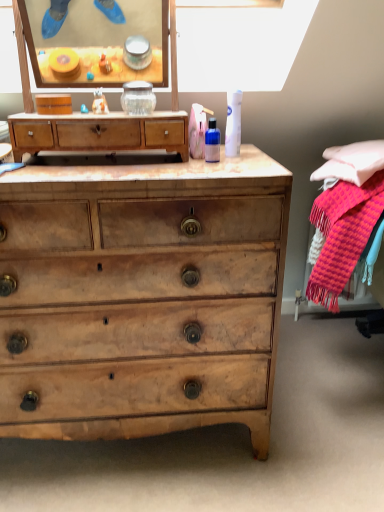
Question: Is translucent plastic bottle at center, which is counted as the second toiletry, starting from the right, a part of light brown wooden chest of drawers at center, which ranks as the first chest of drawers in top-to-bottom order?

Choices:
 (A) yes
 (B) no

Answer: (B)

Question: From the image's perspective, does light brown wooden chest of drawers at center, which ranks as the first chest of drawers in top-to-bottom order, appear lower than translucent plastic bottle at center, which is counted as the second toiletry, starting from the right?

Choices:
 (A) no
 (B) yes

Answer: (A)

Question: Considering the relative sizes of light brown wooden chest of drawers at center, the second chest of drawers in the bottom-to-top sequence, and translucent plastic bottle at center, positioned as the first toiletry in left-to-right order, in the image provided, is light brown wooden chest of drawers at center, the second chest of drawers in the bottom-to-top sequence, smaller than translucent plastic bottle at center, positioned as the first toiletry in left-to-right order,?

Choices:
 (A) no
 (B) yes

Answer: (A)

Question: Does light brown wooden chest of drawers at center, the second chest of drawers in the bottom-to-top sequence, turn towards translucent plastic bottle at center, which is counted as the second toiletry, starting from the right?

Choices:
 (A) yes
 (B) no

Answer: (B)

Question: Can we say light brown wooden chest of drawers at center, the second chest of drawers in the bottom-to-top sequence, lies outside translucent plastic bottle at center, which is counted as the second toiletry, starting from the right?

Choices:
 (A) no
 (B) yes

Answer: (B)

Question: Considering the relative positions of light brown wooden chest of drawers at center, which ranks as the first chest of drawers in top-to-bottom order, and translucent plastic bottle at center, which is counted as the second toiletry, starting from the right, in the image provided, is light brown wooden chest of drawers at center, which ranks as the first chest of drawers in top-to-bottom order, to the right of translucent plastic bottle at center, which is counted as the second toiletry, starting from the right, from the viewer's perspective?

Choices:
 (A) yes
 (B) no

Answer: (B)

Question: Is translucent plastic bottle at center, which is counted as the second toiletry, starting from the right, touching white matte canister at upper center, acting as the first toiletry starting from the right?

Choices:
 (A) no
 (B) yes

Answer: (B)

Question: Is translucent plastic bottle at center, which is counted as the second toiletry, starting from the right, to the right of white matte canister at upper center, acting as the first toiletry starting from the right, from the viewer's perspective?

Choices:
 (A) yes
 (B) no

Answer: (B)

Question: Considering the relative sizes of translucent plastic bottle at center, positioned as the first toiletry in left-to-right order, and white matte canister at upper center, positioned as the 2th toiletry in left-to-right order, in the image provided, is translucent plastic bottle at center, positioned as the first toiletry in left-to-right order, taller than white matte canister at upper center, positioned as the 2th toiletry in left-to-right order,?

Choices:
 (A) yes
 (B) no

Answer: (B)

Question: Is translucent plastic bottle at center, positioned as the first toiletry in left-to-right order, positioned beyond the bounds of white matte canister at upper center, acting as the first toiletry starting from the right?

Choices:
 (A) no
 (B) yes

Answer: (B)

Question: Is translucent plastic bottle at center, which is counted as the second toiletry, starting from the right, further to camera compared to white matte canister at upper center, positioned as the 2th toiletry in left-to-right order?

Choices:
 (A) yes
 (B) no

Answer: (B)

Question: From a real-world perspective, is translucent plastic bottle at center, which is counted as the second toiletry, starting from the right, on white matte canister at upper center, positioned as the 2th toiletry in left-to-right order?

Choices:
 (A) yes
 (B) no

Answer: (B)

Question: From the image's perspective, would you say white matte canister at upper center, acting as the first toiletry starting from the right, is positioned over translucent plastic bottle at center, which is counted as the second toiletry, starting from the right?

Choices:
 (A) no
 (B) yes

Answer: (B)